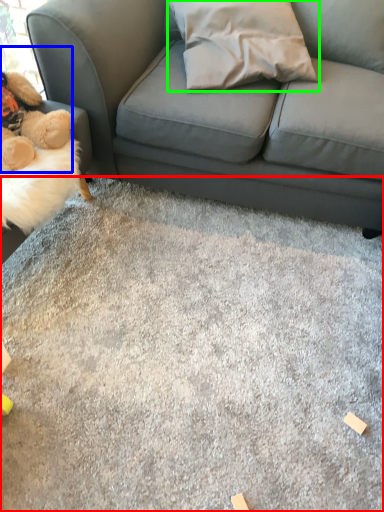
Question: Based on their relative distances, which object is nearer to concrete (highlighted by a red box)? Choose from toy (highlighted by a blue box) and throw pillow (highlighted by a green box).

Choices:
 (A) toy
 (B) throw pillow

Answer: (A)